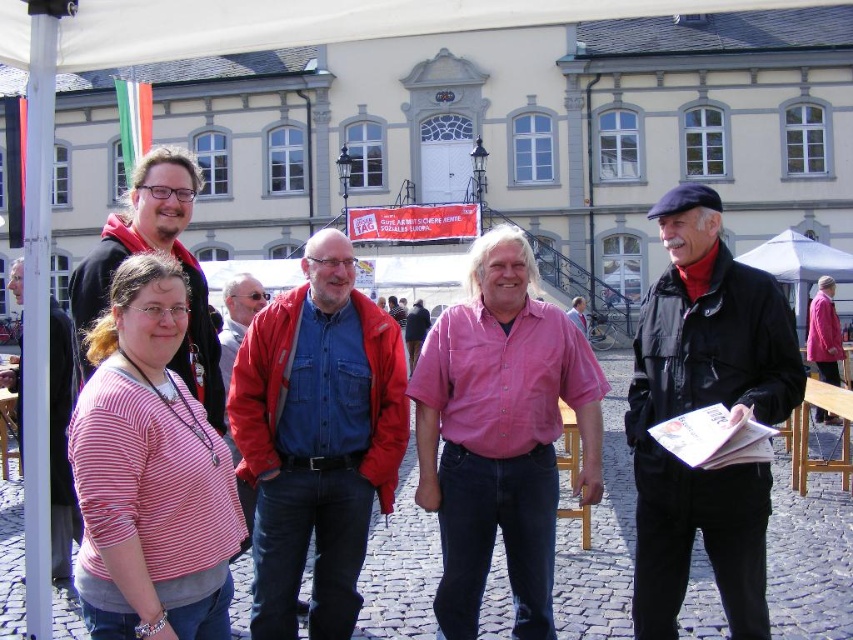
Does black leather jacket at right lie in front of pink striped shirt at left?

No, it is not.

Describe the element at coordinates (701, 406) in the screenshot. I see `black leather jacket at right` at that location.

Is point (758, 596) positioned before point (61, 508)?

Yes, it is.

I want to click on black leather jacket at right, so click(x=701, y=406).

Can you confirm if pink cotton shirt at center is smaller than pink striped shirt at left?

Yes, pink cotton shirt at center is smaller than pink striped shirt at left.

Is pink cotton shirt at center shorter than pink striped shirt at left?

No, pink cotton shirt at center is not shorter than pink striped shirt at left.

Is point (447, 420) behind point (57, 524)?

Yes, point (447, 420) is farther from viewer.

This screenshot has height=640, width=853. Find the location of `pink cotton shirt at center`. pink cotton shirt at center is located at coordinates (502, 435).

Is pink cotton shirt at center thinner than red denim jacket at center?

In fact, pink cotton shirt at center might be wider than red denim jacket at center.

In the scene shown: Is pink cotton shirt at center positioned behind red denim jacket at center?

That is True.

Find the location of a particular element. pink cotton shirt at center is located at coordinates (x=502, y=435).

Find the location of a particular element. pink cotton shirt at center is located at coordinates (502, 435).